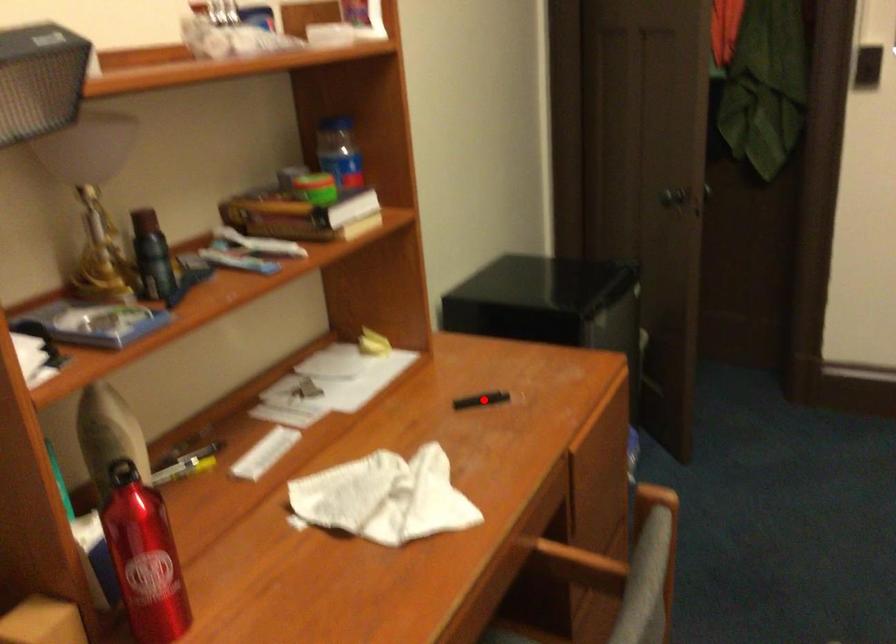
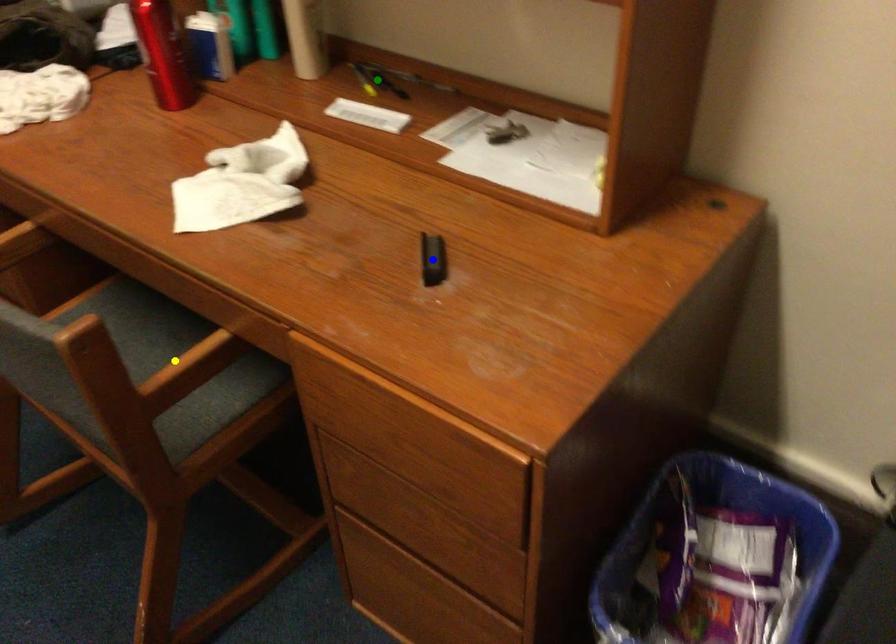
Question: I am providing you with two images of the same scene from different viewpoints. A red point is marked on the first image. You are given multiple points on the second image. Which point in image 2 is actually the same real-world point as the red point in image 1?

Choices:
 (A) yellow point
 (B) blue point
 (C) green point

Answer: (B)